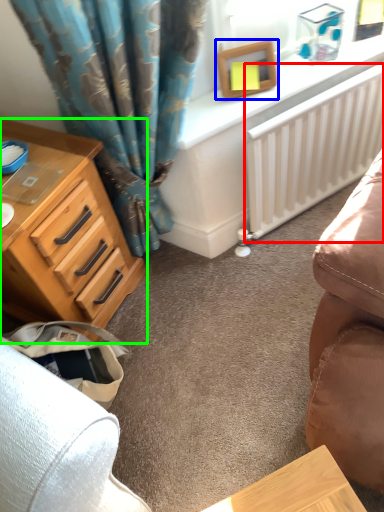
Question: Considering the real-world distances, which object is farthest from radiator (highlighted by a red box)? picture frame (highlighted by a blue box) or chest of drawers (highlighted by a green box)?

Choices:
 (A) picture frame
 (B) chest of drawers

Answer: (B)